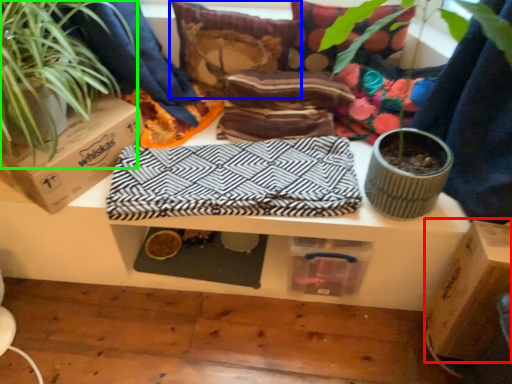
Question: Which is farther away from cardboard box (highlighted by a red box)? pillow (highlighted by a blue box) or houseplant (highlighted by a green box)?

Choices:
 (A) pillow
 (B) houseplant

Answer: (B)